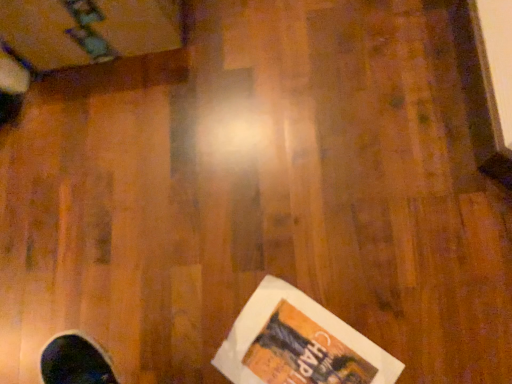
I want to click on vacant space underneath white paper flyer at lower right (from a real-world perspective), so click(300, 343).